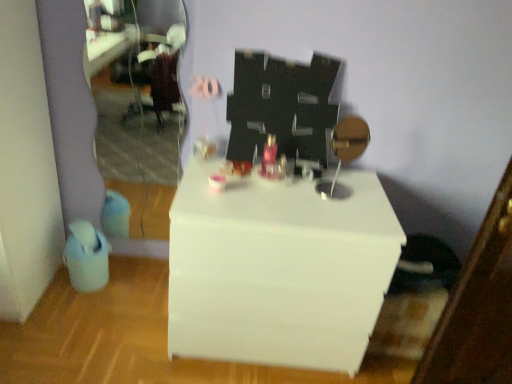
The height and width of the screenshot is (384, 512). Find the location of `vacant space that is to the left of white glossy table at center`. vacant space that is to the left of white glossy table at center is located at coordinates (121, 325).